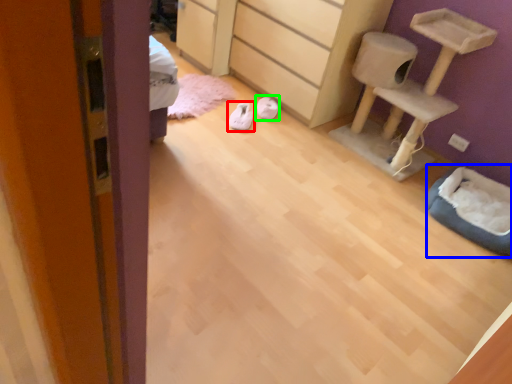
Question: Which object is positioned farthest from footwear (highlighted by a red box)? Select from cat bed (highlighted by a blue box) and footwear (highlighted by a green box).

Choices:
 (A) cat bed
 (B) footwear

Answer: (A)